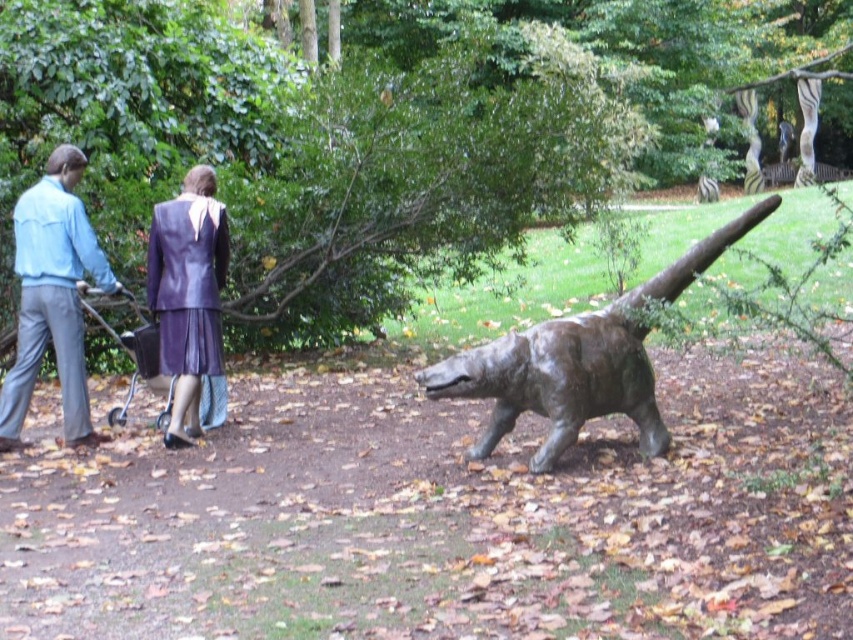
Question: Does bronze statue at center have a lesser width compared to purple leather suit at upper left?

Choices:
 (A) yes
 (B) no

Answer: (B)

Question: Does light blue denim jacket at left appear over purple leather suit at upper left?

Choices:
 (A) no
 (B) yes

Answer: (B)

Question: Which object is farther from the camera taking this photo?

Choices:
 (A) light blue denim jacket at left
 (B) purple leather suit at upper left
 (C) metallic silver baby carriage at left
 (D) bronze statue at center

Answer: (C)

Question: Which object is the closest to the purple leather suit at upper left?

Choices:
 (A) metallic silver baby carriage at left
 (B) bronze statue at center

Answer: (A)

Question: Does bronze statue at center lie behind metallic silver baby carriage at left?

Choices:
 (A) yes
 (B) no

Answer: (B)

Question: Which object is closer to the camera taking this photo?

Choices:
 (A) light blue denim jacket at left
 (B) metallic silver baby carriage at left

Answer: (A)